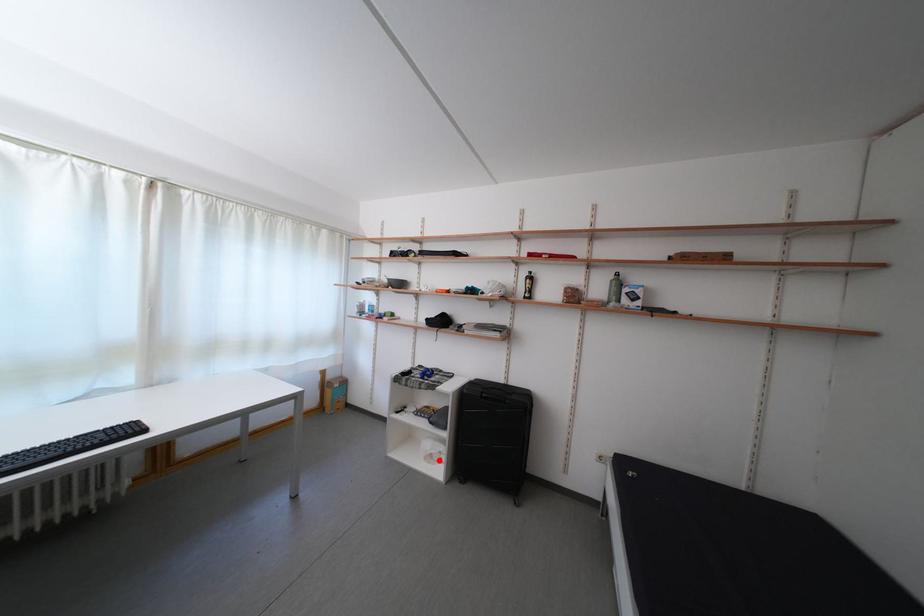
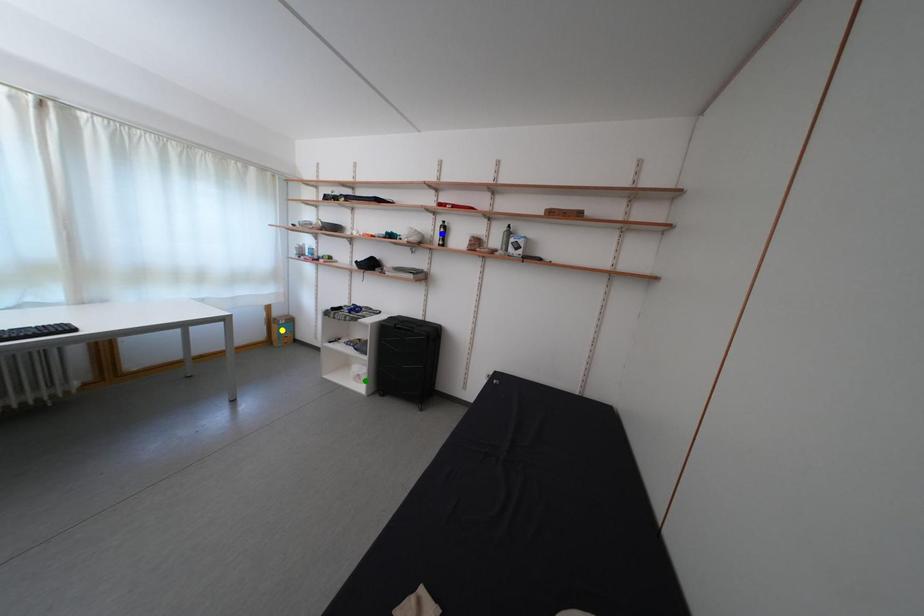
Question: I am providing you with two images of the same scene from different viewpoints. A red point is marked on the first image. You are given multiple points on the second image. In image 2, which mark is for the same physical point as the one in image 1?

Choices:
 (A) yellow point
 (B) blue point
 (C) green point

Answer: (C)